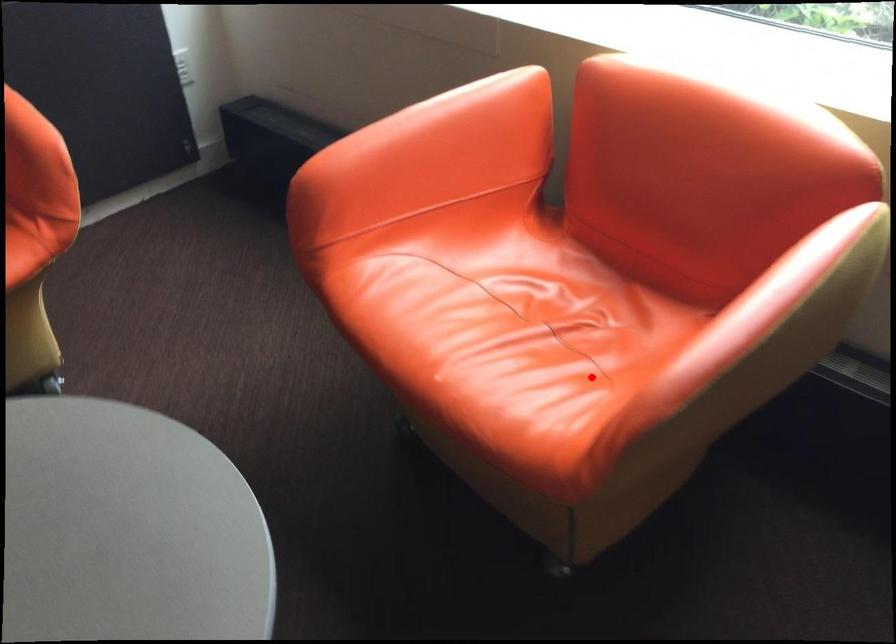
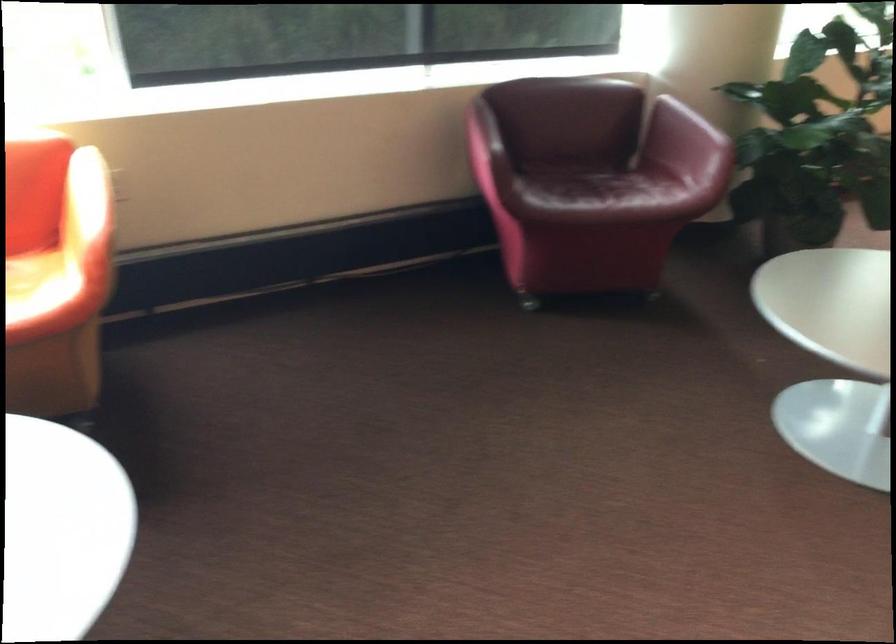
In the second image, find the point that corresponds to the highlighted location in the first image.

(35, 285)